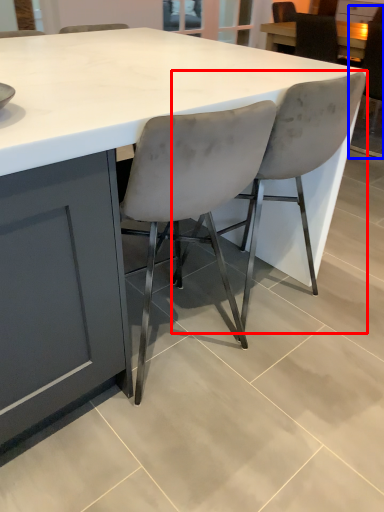
Question: Among these objects, which one is farthest to the camera, chair (highlighted by a red box) or chair (highlighted by a blue box)?

Choices:
 (A) chair
 (B) chair

Answer: (B)